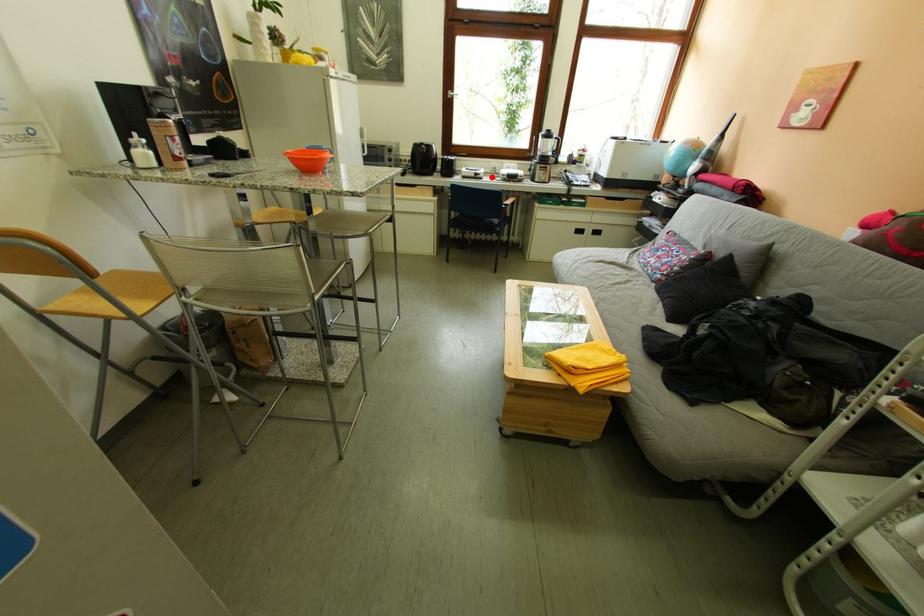
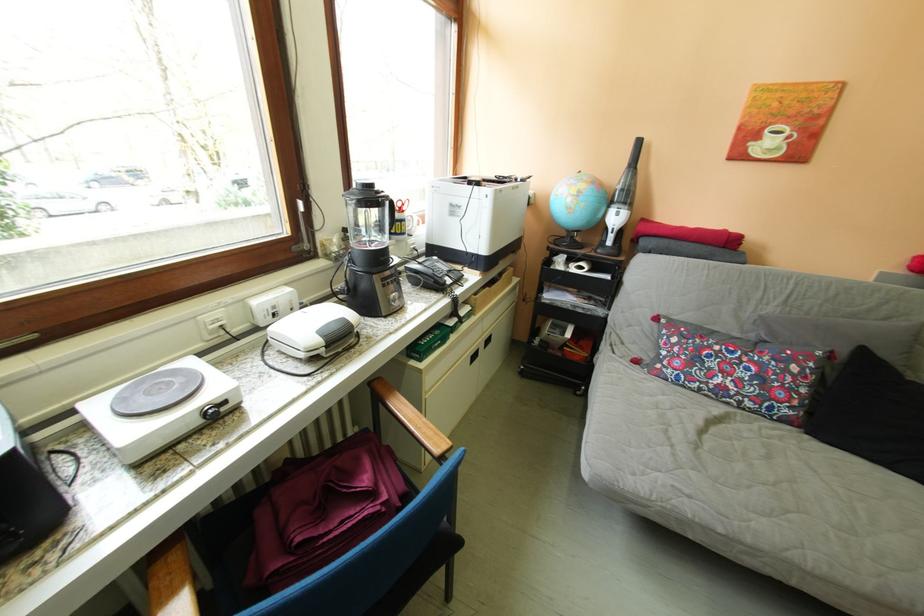
Question: I am providing you with two images of the same scene from different viewpoints. Given a red point in image1, look at the same physical point in image2. Is it:

Choices:
 (A) Closer to the viewpoint
 (B) Farther from the viewpoint

Answer: (B)